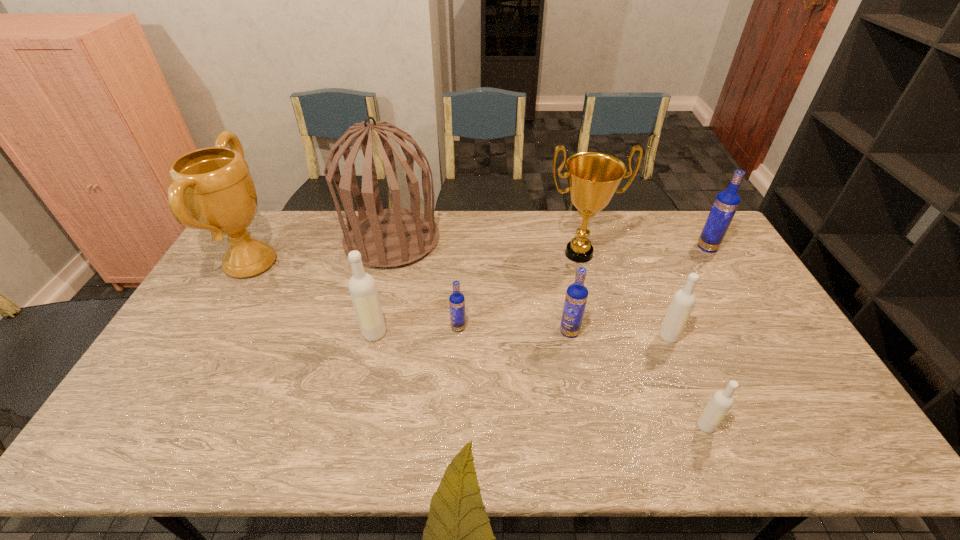
I want to click on free space at the far edge of the desktop, so click(x=667, y=244).

The width and height of the screenshot is (960, 540). In order to click on free space at the near edge of the desktop in this screenshot , I will do `click(332, 455)`.

This screenshot has width=960, height=540. I want to click on vacant space at the left edge of the desktop, so click(217, 295).

In the image, there is a desktop. Find the location of `vacant space at the right edge`. vacant space at the right edge is located at coordinates (769, 352).

The width and height of the screenshot is (960, 540). In the image, there is a desktop. In order to click on vacant space at the near left corner in this screenshot , I will do `click(93, 459)`.

Find the location of `vacant space that's between the second smallest white vodka and the second blue vodka from left to right`. vacant space that's between the second smallest white vodka and the second blue vodka from left to right is located at coordinates (619, 334).

The height and width of the screenshot is (540, 960). In order to click on free space that is in between the leftmost object and the rightmost blue vodka in this screenshot , I will do `click(479, 255)`.

Locate an element on the screen. This screenshot has width=960, height=540. free spot between the leftmost vodka and the leftmost object is located at coordinates (313, 298).

This screenshot has width=960, height=540. In order to click on vacant space that is in between the farthest blue vodka and the gold award in this screenshot , I will do `click(643, 251)`.

Locate an element on the screen. The width and height of the screenshot is (960, 540). unoccupied area between the biggest white vodka and the second biggest blue vodka is located at coordinates (471, 332).